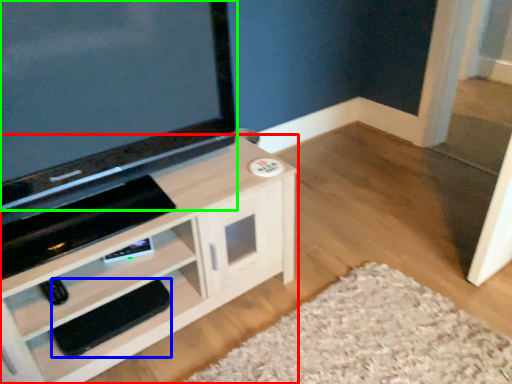
Question: Based on their relative distances, which object is farther from cabinetry (highlighted by a red box)? Choose from footrest (highlighted by a blue box) and television (highlighted by a green box).

Choices:
 (A) footrest
 (B) television

Answer: (B)